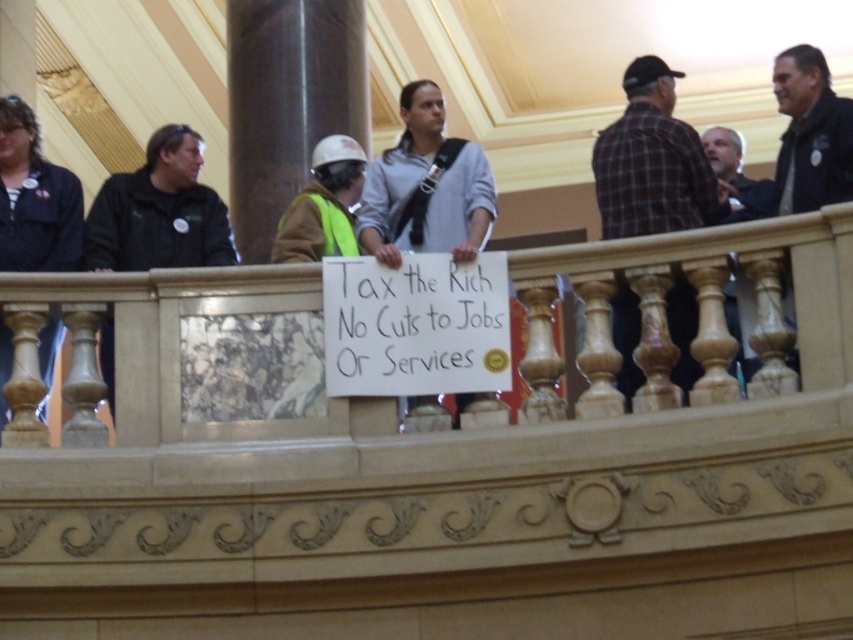
You are a photographer standing at the far end of the room. You want to take a photo of the hard hat at center and the black leather jacket at left. If your camera has a maximum focus range of 20 feet, will you be able to capture both objects clearly in the same frame?

The black leather jacket at left is 19.95 feet from the hard hat at center. Since the camera can focus up to 20 feet, both objects are within the 20 feet range, so yes, you can capture both clearly in the same frame.

You are a photographer standing in the scene and want to take a photo of the hard hat at center and the black leather jacket at left. Which object will appear larger in the photo?

The black leather jacket at left appears larger in the photo because it is closer to the viewer than the hard hat at center.